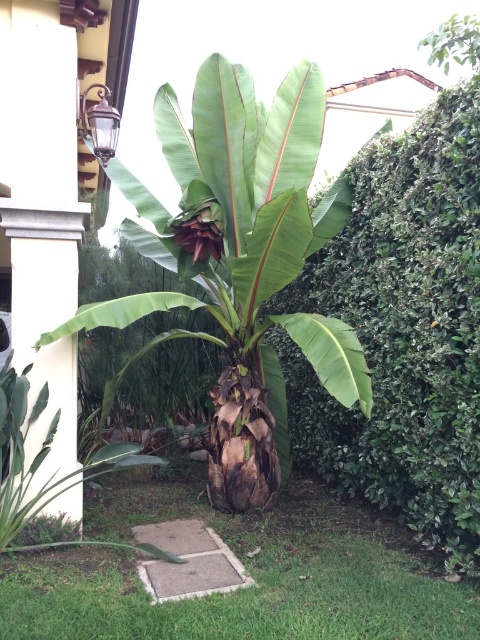
Locate an element on the screen. This screenshot has height=640, width=480. green leafy bush at center is located at coordinates (404, 332).

Based on the photo, who is more forward, (411, 317) or (135, 486)?

Positioned in front is point (411, 317).

Image resolution: width=480 pixels, height=640 pixels. What do you see at coordinates (404, 332) in the screenshot?
I see `green leafy bush at center` at bounding box center [404, 332].

Image resolution: width=480 pixels, height=640 pixels. What are the coordinates of `green leafy bush at center` in the screenshot? It's located at (404, 332).

Can you confirm if green leafy banana tree at center is positioned to the left of green grass at center?

Incorrect, green leafy banana tree at center is not on the left side of green grass at center.

Based on the photo, between green leafy banana tree at center and green grass at center, which one is positioned lower?

green grass at center is below.

The image size is (480, 640). What are the coordinates of `green leafy banana tree at center` in the screenshot? It's located at (240, 260).

Describe the element at coordinates (404, 332) in the screenshot. I see `green leafy bush at center` at that location.

Can you confirm if green leafy bush at center is positioned below green leafy banana tree at center?

Correct, green leafy bush at center is located below green leafy banana tree at center.

This screenshot has width=480, height=640. What are the coordinates of `green leafy bush at center` in the screenshot? It's located at (404, 332).

Image resolution: width=480 pixels, height=640 pixels. Find the location of `green leafy bush at center`. green leafy bush at center is located at coordinates (404, 332).